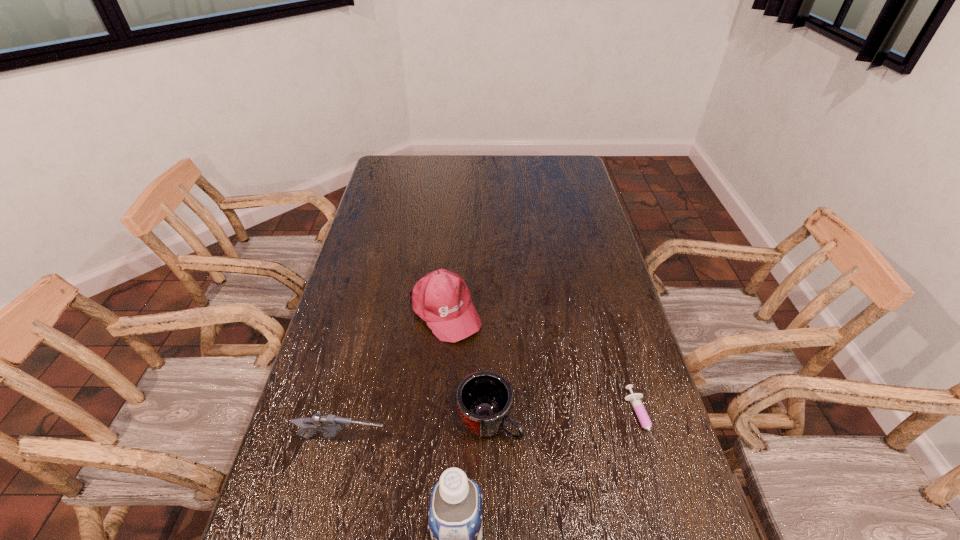
The image size is (960, 540). What are the coordinates of `syringe` in the screenshot? It's located at (635, 399).

The width and height of the screenshot is (960, 540). I want to click on the shortest object, so click(635, 399).

You are a GUI agent. You are given a task and a screenshot of the screen. Output one action in this format:
    pyautogui.click(x=<x>, y=<y>)
    Task: Click on the gun
    The image size is (960, 540).
    Given the screenshot: What is the action you would take?
    pyautogui.click(x=332, y=424)

The width and height of the screenshot is (960, 540). I want to click on the farthest object, so click(x=441, y=298).

The image size is (960, 540). I want to click on mug, so click(484, 399).

Image resolution: width=960 pixels, height=540 pixels. Identify the location of free space located 0.280m on the back of the shortest object. (608, 312).

Find the location of a particular element. vacant region located at the barrel of the gun is located at coordinates (526, 462).

Locate an element on the screen. free spot located 0.230m at the barrel of the gun is located at coordinates (484, 456).

You are a GUI agent. You are given a task and a screenshot of the screen. Output one action in this format:
    pyautogui.click(x=<x>, y=<y>)
    Task: Click on the blank area located at the barrel of the gun
    Image resolution: width=960 pixels, height=540 pixels.
    Given the screenshot: What is the action you would take?
    coord(455,451)

Locate an element on the screen. The image size is (960, 540). free space located at the front of the farthest object with the brim is located at coordinates (479, 361).